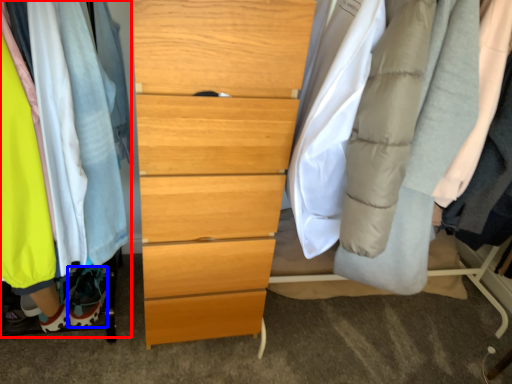
Question: Which point is further to the camera, closet (highlighted by a red box) or shoe (highlighted by a blue box)?

Choices:
 (A) closet
 (B) shoe

Answer: (B)